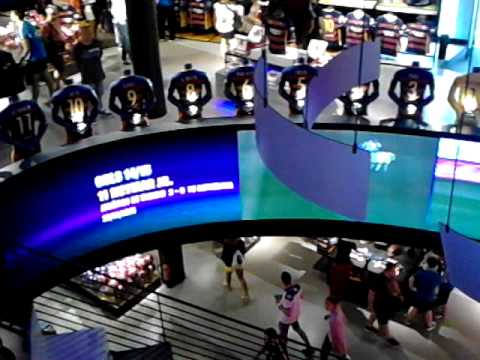
The image size is (480, 360). I want to click on cord, so click(355, 122), click(453, 160), click(264, 38).